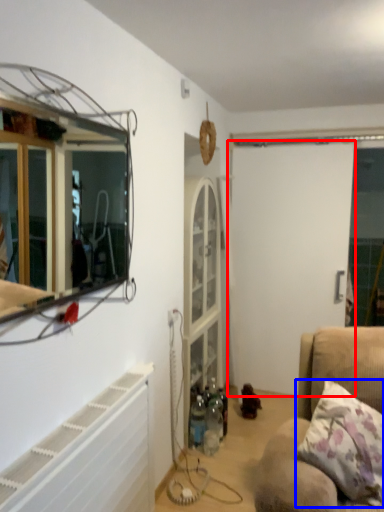
Question: Which of the following is the closest to the observer, screen door (highlighted by a red box) or pillow (highlighted by a blue box)?

Choices:
 (A) screen door
 (B) pillow

Answer: (B)